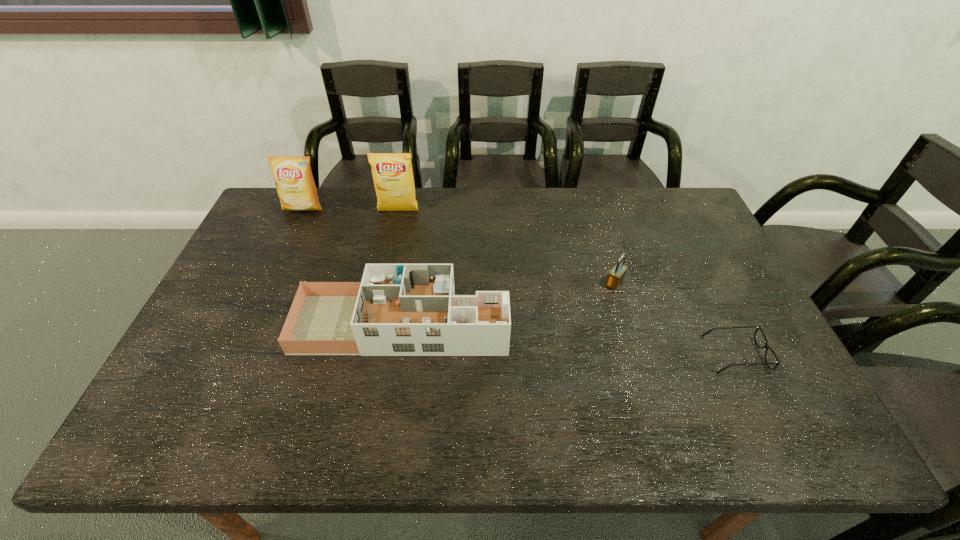
Where is `free space at the left edge of the desktop`? free space at the left edge of the desktop is located at coordinates (242, 281).

Image resolution: width=960 pixels, height=540 pixels. I want to click on vacant space at the right edge, so click(x=710, y=246).

Where is `free region at the near left corner of the desktop`? Image resolution: width=960 pixels, height=540 pixels. free region at the near left corner of the desktop is located at coordinates (147, 437).

The image size is (960, 540). Find the location of `free area in between the right crisp (potato chip) and the spectacles`. free area in between the right crisp (potato chip) and the spectacles is located at coordinates (566, 282).

Find the location of a particular element. Image resolution: width=960 pixels, height=540 pixels. free space between the left crisp (potato chip) and the right crisp (potato chip) is located at coordinates (350, 210).

You are a GUI agent. You are given a task and a screenshot of the screen. Output one action in this format:
    pyautogui.click(x=<x>, y=<y>)
    Task: Click on the vacant region between the right crisp (potato chip) and the fourth object from left to right
    The image size is (960, 540).
    Given the screenshot: What is the action you would take?
    click(x=507, y=247)

Image resolution: width=960 pixels, height=540 pixels. Find the location of `vacant area that lies between the shortest object and the dollhouse`. vacant area that lies between the shortest object and the dollhouse is located at coordinates (568, 339).

You are a GUI agent. You are given a task and a screenshot of the screen. Output one action in this format:
    pyautogui.click(x=<x>, y=<y>)
    Task: Click on the vacant area that lies between the padlock and the second tallest object
    
    Given the screenshot: What is the action you would take?
    tap(459, 246)

Where is `free area in between the dollhouse and the leftmost object`? This screenshot has height=540, width=960. free area in between the dollhouse and the leftmost object is located at coordinates (x=352, y=266).

Where is `free spot between the dollhouse and the shorter crisp (potato chip)`? The image size is (960, 540). free spot between the dollhouse and the shorter crisp (potato chip) is located at coordinates (352, 266).